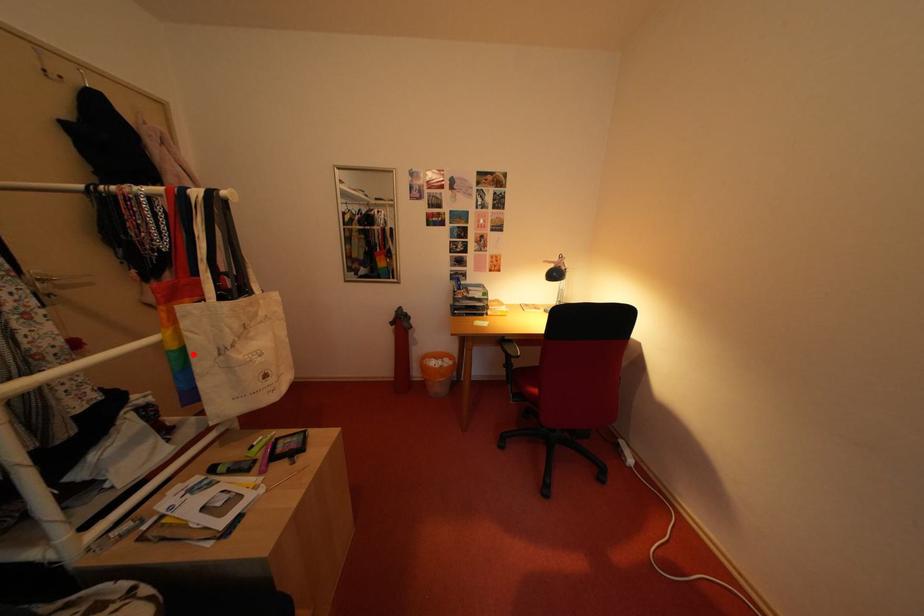
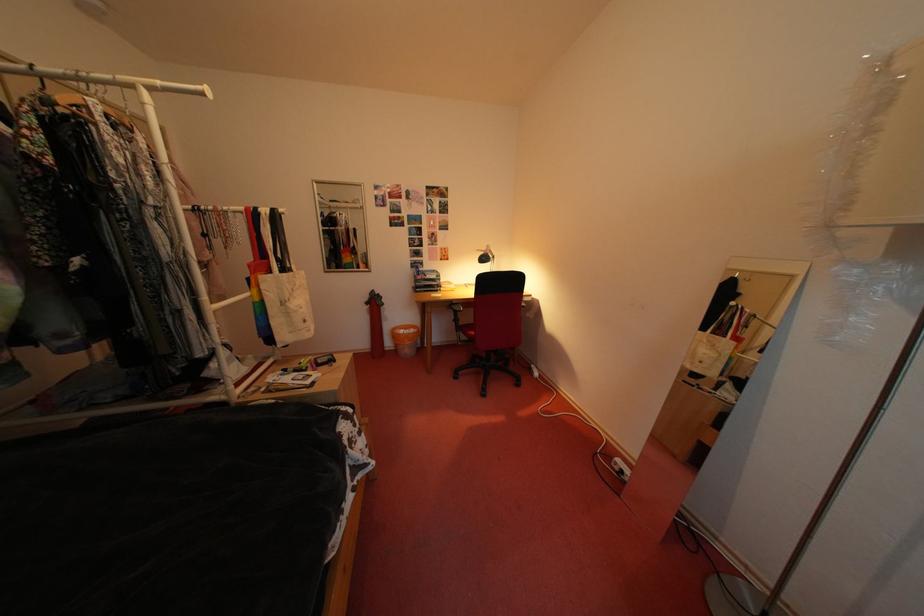
The point at the highlighted location is marked in the first image. Where is the corresponding point in the second image?

(273, 306)